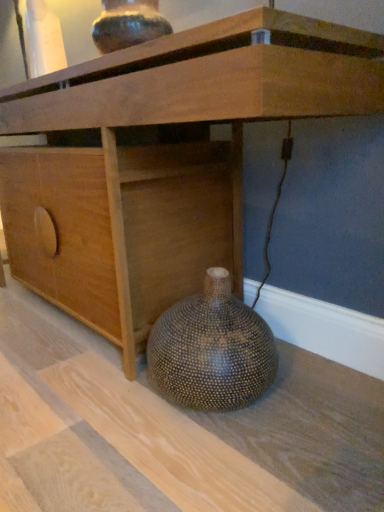
Question: Is speckled ceramic vase at upper center, which is the first vase from top to bottom, positioned before brown textured vase at lower right, which ranks as the 2th vase in top-to-bottom order?

Choices:
 (A) no
 (B) yes

Answer: (A)

Question: Does speckled ceramic vase at upper center, which is the first vase from top to bottom, have a lesser width compared to brown textured vase at lower right, which ranks as the 2th vase in top-to-bottom order?

Choices:
 (A) no
 (B) yes

Answer: (B)

Question: From the image's perspective, does speckled ceramic vase at upper center, which is the first vase from top to bottom, appear lower than brown textured vase at lower right, which ranks as the 2th vase in top-to-bottom order?

Choices:
 (A) no
 (B) yes

Answer: (A)

Question: Is speckled ceramic vase at upper center, the 2th vase when ordered from bottom to top, positioned beyond the bounds of brown textured vase at lower right, which ranks as the 2th vase in top-to-bottom order?

Choices:
 (A) yes
 (B) no

Answer: (A)

Question: Is speckled ceramic vase at upper center, which is the first vase from top to bottom, smaller than brown textured vase at lower right, the 1th vase in the bottom-to-top sequence?

Choices:
 (A) no
 (B) yes

Answer: (B)

Question: From a real-world perspective, is speckled ceramic vase at upper center, the 2th vase when ordered from bottom to top, on top of brown textured vase at lower right, the 1th vase in the bottom-to-top sequence?

Choices:
 (A) yes
 (B) no

Answer: (A)

Question: From the image's perspective, is wooden cabinet at lower center on top of speckled ceramic vase at upper center, the 2th vase when ordered from bottom to top?

Choices:
 (A) no
 (B) yes

Answer: (A)

Question: Would you say wooden cabinet at lower center is outside speckled ceramic vase at upper center, the 2th vase when ordered from bottom to top?

Choices:
 (A) yes
 (B) no

Answer: (A)

Question: Is wooden cabinet at lower center closer to the viewer compared to speckled ceramic vase at upper center, which is the first vase from top to bottom?

Choices:
 (A) yes
 (B) no

Answer: (A)

Question: Could speckled ceramic vase at upper center, the 2th vase when ordered from bottom to top, be considered to be inside wooden cabinet at lower center?

Choices:
 (A) yes
 (B) no

Answer: (B)

Question: Is wooden cabinet at lower center smaller than speckled ceramic vase at upper center, the 2th vase when ordered from bottom to top?

Choices:
 (A) yes
 (B) no

Answer: (B)

Question: Is wooden cabinet at lower center thinner than speckled ceramic vase at upper center, the 2th vase when ordered from bottom to top?

Choices:
 (A) no
 (B) yes

Answer: (A)

Question: Is wooden cabinet at lower center located within speckled ceramic vase at upper center, which is the first vase from top to bottom?

Choices:
 (A) yes
 (B) no

Answer: (B)